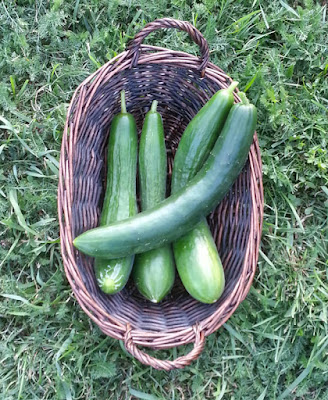
Where is `wicker basket brown`? Image resolution: width=328 pixels, height=400 pixels. wicker basket brown is located at coordinates (148, 322).